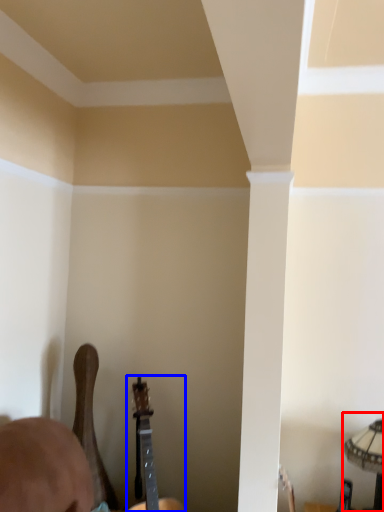
Question: Which object appears farthest to the camera in this image, lamp (highlighted by a red box) or guitar (highlighted by a blue box)?

Choices:
 (A) lamp
 (B) guitar

Answer: (B)